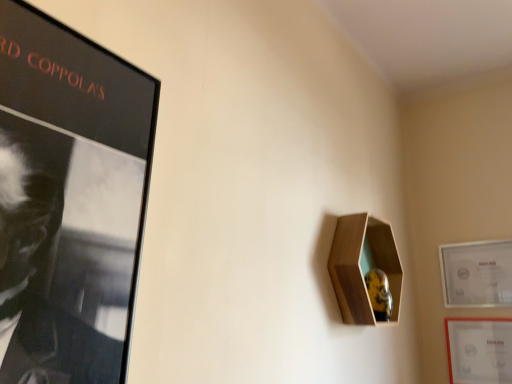
What do you see at coordinates (477, 274) in the screenshot? I see `matte white picture frame at right, placed as the first picture frame when sorted from top to bottom` at bounding box center [477, 274].

Identify the location of matte white picture frame at right, positioned as the 2th picture frame in bottom-to-top order. (477, 274).

From the image's perspective, would you say matte white picture frame at right, placed as the first picture frame when sorted from top to bottom, is shown under matte white picture frame at lower right, which is the 2th picture frame in top-to-bottom order?

Actually, matte white picture frame at right, placed as the first picture frame when sorted from top to bottom, appears above matte white picture frame at lower right, which is the 2th picture frame in top-to-bottom order, in the image.

Could you measure the distance between matte white picture frame at right, placed as the first picture frame when sorted from top to bottom, and matte white picture frame at lower right, which ranks as the first picture frame in bottom-to-top order?

The distance of matte white picture frame at right, placed as the first picture frame when sorted from top to bottom, from matte white picture frame at lower right, which ranks as the first picture frame in bottom-to-top order, is 5.75 inches.

Locate an element on the screen. The image size is (512, 384). picture frame on the left of matte white picture frame at right, placed as the first picture frame when sorted from top to bottom is located at coordinates (479, 350).

Is matte white picture frame at right, positioned as the 2th picture frame in bottom-to-top order, spatially inside matte white picture frame at lower right, which ranks as the first picture frame in bottom-to-top order, or outside of it?

matte white picture frame at right, positioned as the 2th picture frame in bottom-to-top order, is spatially situated outside matte white picture frame at lower right, which ranks as the first picture frame in bottom-to-top order.

Does point (456, 358) come closer to viewer compared to point (354, 260)?

No, (456, 358) is behind (354, 260).

What's the angular difference between matte white picture frame at lower right, which ranks as the first picture frame in bottom-to-top order, and wooden hexagonal shelf at upper right's facing directions?

89.5 degrees.

From a real-world perspective, is matte white picture frame at lower right, which is the 2th picture frame in top-to-bottom order, above or below wooden hexagonal shelf at upper right?

From a real-world perspective, matte white picture frame at lower right, which is the 2th picture frame in top-to-bottom order, is physically below wooden hexagonal shelf at upper right.

Can you confirm if matte white picture frame at lower right, which ranks as the first picture frame in bottom-to-top order, is bigger than wooden hexagonal shelf at upper right?

Actually, matte white picture frame at lower right, which ranks as the first picture frame in bottom-to-top order, might be smaller than wooden hexagonal shelf at upper right.

From the image's perspective, does wooden hexagonal shelf at upper right appear higher than matte white picture frame at lower right, which ranks as the first picture frame in bottom-to-top order?

Indeed, from the image's perspective, wooden hexagonal shelf at upper right is shown above matte white picture frame at lower right, which ranks as the first picture frame in bottom-to-top order.

Is there a large distance between wooden hexagonal shelf at upper right and matte white picture frame at lower right, which ranks as the first picture frame in bottom-to-top order?

That's not correct — wooden hexagonal shelf at upper right is a little close to matte white picture frame at lower right, which ranks as the first picture frame in bottom-to-top order.

In order to click on cabinet in front of the matte white picture frame at lower right, which is the 2th picture frame in top-to-bottom order in this screenshot , I will do `click(362, 266)`.

Would you say matte white picture frame at lower right, which is the 2th picture frame in top-to-bottom order, is part of wooden hexagonal shelf at upper right's contents?

Actually, matte white picture frame at lower right, which is the 2th picture frame in top-to-bottom order, is outside wooden hexagonal shelf at upper right.

Is matte white picture frame at right, placed as the first picture frame when sorted from top to bottom, looking in the opposite direction of wooden hexagonal shelf at upper right?

matte white picture frame at right, placed as the first picture frame when sorted from top to bottom, does not have its back to wooden hexagonal shelf at upper right.

In the scene shown: In the image, is matte white picture frame at right, positioned as the 2th picture frame in bottom-to-top order, positioned in front of or behind wooden hexagonal shelf at upper right?

matte white picture frame at right, positioned as the 2th picture frame in bottom-to-top order, is behind wooden hexagonal shelf at upper right.

Is matte white picture frame at right, positioned as the 2th picture frame in bottom-to-top order, bigger than wooden hexagonal shelf at upper right?

No, matte white picture frame at right, positioned as the 2th picture frame in bottom-to-top order, is not bigger than wooden hexagonal shelf at upper right.

Does point (472, 261) come closer to viewer compared to point (389, 232)?

No.

Is matte white picture frame at lower right, which ranks as the first picture frame in bottom-to-top order, in front of or behind matte white picture frame at right, positioned as the 2th picture frame in bottom-to-top order, in the image?

matte white picture frame at lower right, which ranks as the first picture frame in bottom-to-top order, is in front of matte white picture frame at right, positioned as the 2th picture frame in bottom-to-top order.

Which of these two, matte white picture frame at lower right, which is the 2th picture frame in top-to-bottom order, or matte white picture frame at right, positioned as the 2th picture frame in bottom-to-top order, is smaller?

Smaller between the two is matte white picture frame at lower right, which is the 2th picture frame in top-to-bottom order.

In the scene shown: How much distance is there between matte white picture frame at lower right, which ranks as the first picture frame in bottom-to-top order, and matte white picture frame at right, positioned as the 2th picture frame in bottom-to-top order?

The distance of matte white picture frame at lower right, which ranks as the first picture frame in bottom-to-top order, from matte white picture frame at right, positioned as the 2th picture frame in bottom-to-top order, is 5.75 inches.

Considering the relative sizes of matte white picture frame at lower right, which ranks as the first picture frame in bottom-to-top order, and matte white picture frame at right, placed as the first picture frame when sorted from top to bottom, in the image provided, is matte white picture frame at lower right, which ranks as the first picture frame in bottom-to-top order, taller than matte white picture frame at right, placed as the first picture frame when sorted from top to bottom,?

In fact, matte white picture frame at lower right, which ranks as the first picture frame in bottom-to-top order, may be shorter than matte white picture frame at right, placed as the first picture frame when sorted from top to bottom.

Considering the sizes of objects wooden hexagonal shelf at upper right and matte white picture frame at right, placed as the first picture frame when sorted from top to bottom, in the image provided, who is bigger, wooden hexagonal shelf at upper right or matte white picture frame at right, placed as the first picture frame when sorted from top to bottom,?

wooden hexagonal shelf at upper right is bigger.

How different are the orientations of wooden hexagonal shelf at upper right and matte white picture frame at right, placed as the first picture frame when sorted from top to bottom, in degrees?

There is a 89.5-degree angle between the facing directions of wooden hexagonal shelf at upper right and matte white picture frame at right, placed as the first picture frame when sorted from top to bottom.

From the image's perspective, between wooden hexagonal shelf at upper right and matte white picture frame at right, placed as the first picture frame when sorted from top to bottom, who is located below?

matte white picture frame at right, placed as the first picture frame when sorted from top to bottom, from the image's perspective.

Where is `cabinet on the left of matte white picture frame at right, positioned as the 2th picture frame in bottom-to-top order`? The image size is (512, 384). cabinet on the left of matte white picture frame at right, positioned as the 2th picture frame in bottom-to-top order is located at coordinates pos(362,266).

The height and width of the screenshot is (384, 512). What are the coordinates of `picture frame on the left of matte white picture frame at right, placed as the first picture frame when sorted from top to bottom` in the screenshot? It's located at (479, 350).

You are a GUI agent. You are given a task and a screenshot of the screen. Output one action in this format:
    pyautogui.click(x=<x>, y=<y>)
    Task: Click on the cabinet in front of the matte white picture frame at lower right, which ranks as the first picture frame in bottom-to-top order
    This screenshot has width=512, height=384.
    Given the screenshot: What is the action you would take?
    pyautogui.click(x=362, y=266)

Based on their spatial positions, is matte white picture frame at lower right, which ranks as the first picture frame in bottom-to-top order, or wooden hexagonal shelf at upper right closer to matte white picture frame at right, positioned as the 2th picture frame in bottom-to-top order?

Among the two, matte white picture frame at lower right, which ranks as the first picture frame in bottom-to-top order, is located nearer to matte white picture frame at right, positioned as the 2th picture frame in bottom-to-top order.

Estimate the real-world distances between objects in this image. Which object is closer to wooden hexagonal shelf at upper right, matte white picture frame at lower right, which is the 2th picture frame in top-to-bottom order, or matte white picture frame at right, placed as the first picture frame when sorted from top to bottom?

Among the two, matte white picture frame at right, placed as the first picture frame when sorted from top to bottom, is located nearer to wooden hexagonal shelf at upper right.

Considering their positions, is matte white picture frame at right, placed as the first picture frame when sorted from top to bottom, positioned closer to wooden hexagonal shelf at upper right than matte white picture frame at lower right, which is the 2th picture frame in top-to-bottom order?

matte white picture frame at right, placed as the first picture frame when sorted from top to bottom, is positioned closer to the anchor wooden hexagonal shelf at upper right.

When comparing their distances from matte white picture frame at lower right, which ranks as the first picture frame in bottom-to-top order, does matte white picture frame at right, positioned as the 2th picture frame in bottom-to-top order, or wooden hexagonal shelf at upper right seem further?

Based on the image, wooden hexagonal shelf at upper right appears to be further to matte white picture frame at lower right, which ranks as the first picture frame in bottom-to-top order.

When comparing their distances from matte white picture frame at lower right, which is the 2th picture frame in top-to-bottom order, does wooden hexagonal shelf at upper right or matte white picture frame at right, positioned as the 2th picture frame in bottom-to-top order, seem closer?

Among the two, matte white picture frame at right, positioned as the 2th picture frame in bottom-to-top order, is located nearer to matte white picture frame at lower right, which is the 2th picture frame in top-to-bottom order.

Estimate the real-world distances between objects in this image. Which object is closer to matte white picture frame at right, placed as the first picture frame when sorted from top to bottom, wooden hexagonal shelf at upper right or matte white picture frame at lower right, which is the 2th picture frame in top-to-bottom order?

The object closer to matte white picture frame at right, placed as the first picture frame when sorted from top to bottom, is matte white picture frame at lower right, which is the 2th picture frame in top-to-bottom order.

Find the location of a particular element. Image resolution: width=512 pixels, height=384 pixels. picture frame situated between wooden hexagonal shelf at upper right and matte white picture frame at right, placed as the first picture frame when sorted from top to bottom, from left to right is located at coordinates (479, 350).